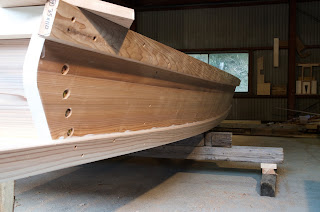
You are a GUI agent. You are given a task and a screenshot of the screen. Output one action in this format:
    pyautogui.click(x=<x>, y=<y>)
    Task: Click on the floor
    The image size is (320, 212).
    Given the screenshot: What is the action you would take?
    pyautogui.click(x=91, y=166), pyautogui.click(x=47, y=202), pyautogui.click(x=187, y=208), pyautogui.click(x=290, y=199), pyautogui.click(x=298, y=143), pyautogui.click(x=264, y=140)